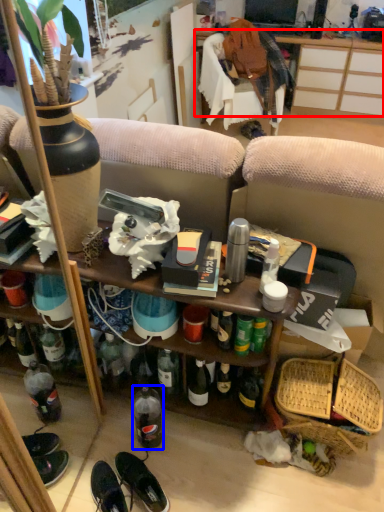
Question: Among these objects, which one is nearest to the camera, desk (highlighted by a red box) or bottle (highlighted by a blue box)?

Choices:
 (A) desk
 (B) bottle

Answer: (B)